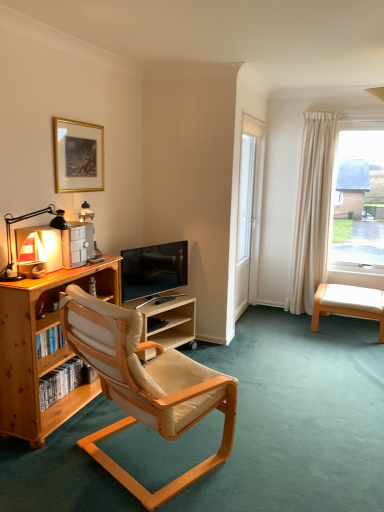
Question: From a real-world perspective, is wooden bookcase at left physically located above or below white glass screen door at center?

Choices:
 (A) above
 (B) below

Answer: (B)

Question: In terms of width, does wooden bookcase at left look wider or thinner when compared to white glass screen door at center?

Choices:
 (A) thin
 (B) wide

Answer: (B)

Question: Considering the real-world distances, which object is closest to the wooden bookcase at left?

Choices:
 (A) matte black desk lamp at left
 (B) beige leather swivel chair at lower right
 (C) white glass screen door at center
 (D) gold metallic picture frame at upper left
 (E) light wood/woodenobject at center

Answer: (A)

Question: Considering the real-world distances, which object is farthest from the matte black desk lamp at left?

Choices:
 (A) beige leather chair at center
 (B) beige leather swivel chair at lower right
 (C) matte black tv at center
 (D) white glass screen door at center
 (E) light wood/woodenobject at center

Answer: (B)